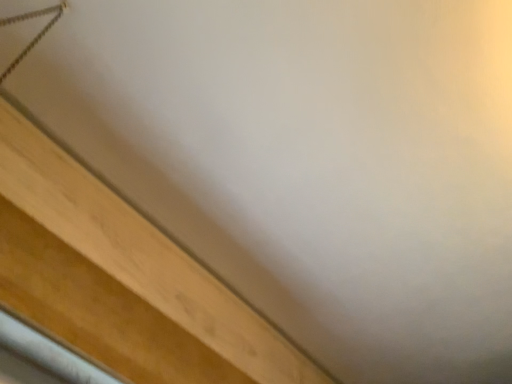
Question: Can you confirm if light wood plank at lower left is taller than metallic rope at upper left?

Choices:
 (A) no
 (B) yes

Answer: (A)

Question: Does light wood plank at lower left have a smaller size compared to metallic rope at upper left?

Choices:
 (A) yes
 (B) no

Answer: (B)

Question: Is light wood plank at lower left at the right side of metallic rope at upper left?

Choices:
 (A) yes
 (B) no

Answer: (A)

Question: Is light wood plank at lower left not near metallic rope at upper left?

Choices:
 (A) no
 (B) yes

Answer: (A)

Question: Is light wood plank at lower left turned away from metallic rope at upper left?

Choices:
 (A) no
 (B) yes

Answer: (A)

Question: From a real-world perspective, is light wood plank at lower left below metallic rope at upper left?

Choices:
 (A) yes
 (B) no

Answer: (A)

Question: Is metallic rope at upper left taller than light wood plank at lower left?

Choices:
 (A) no
 (B) yes

Answer: (B)

Question: From a real-world perspective, is metallic rope at upper left physically above light wood plank at lower left?

Choices:
 (A) yes
 (B) no

Answer: (A)

Question: Is there a large distance between metallic rope at upper left and light wood plank at lower left?

Choices:
 (A) no
 (B) yes

Answer: (A)

Question: Is metallic rope at upper left at the left side of light wood plank at lower left?

Choices:
 (A) no
 (B) yes

Answer: (B)

Question: Is metallic rope at upper left positioned in front of light wood plank at lower left?

Choices:
 (A) yes
 (B) no

Answer: (A)

Question: Considering the relative sizes of metallic rope at upper left and light wood plank at lower left in the image provided, is metallic rope at upper left bigger than light wood plank at lower left?

Choices:
 (A) no
 (B) yes

Answer: (A)

Question: Is metallic rope at upper left wider or thinner than light wood plank at lower left?

Choices:
 (A) wide
 (B) thin

Answer: (A)